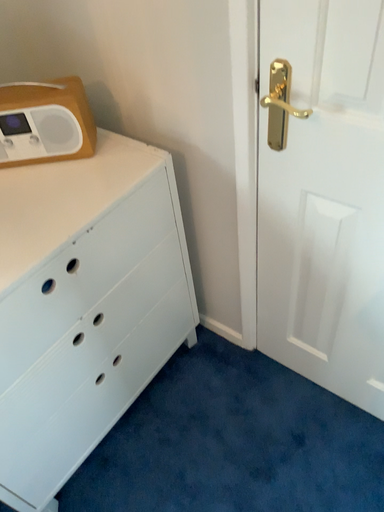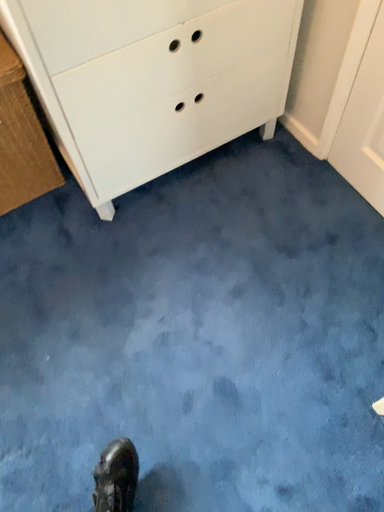
Question: How did the camera likely rotate when shooting the video?

Choices:
 (A) rotated downward
 (B) rotated upward

Answer: (A)